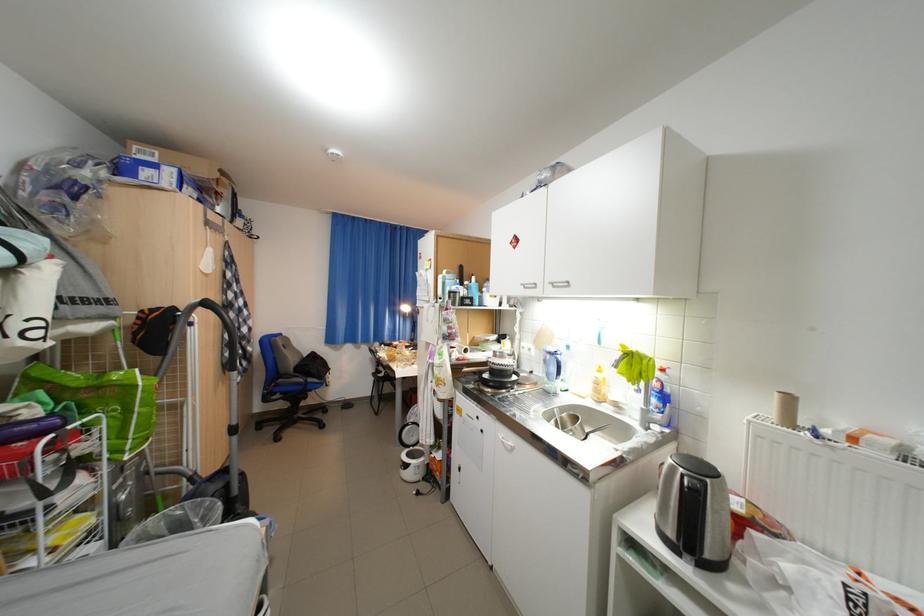
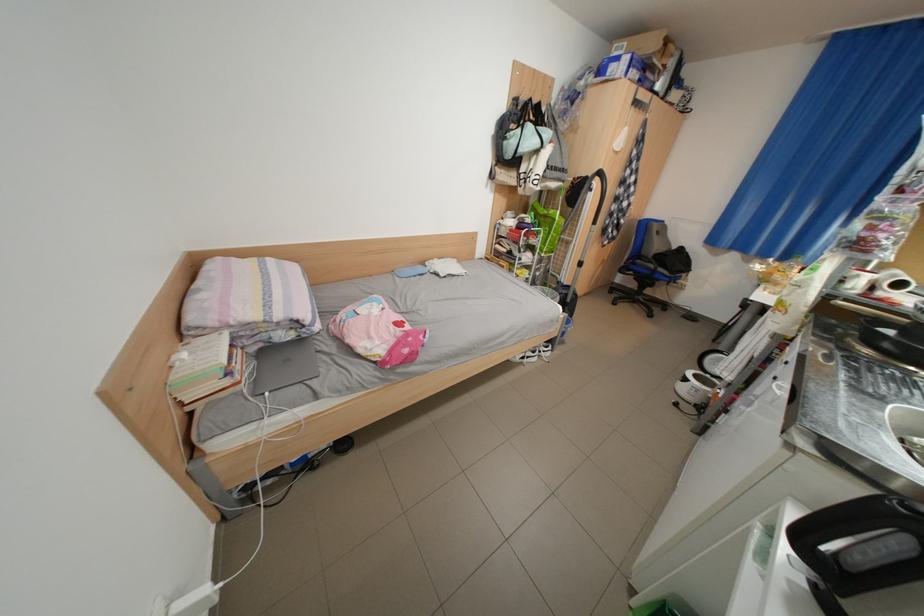
Where in the second image is the point corresponding to [508,386] from the first image?

(900, 347)